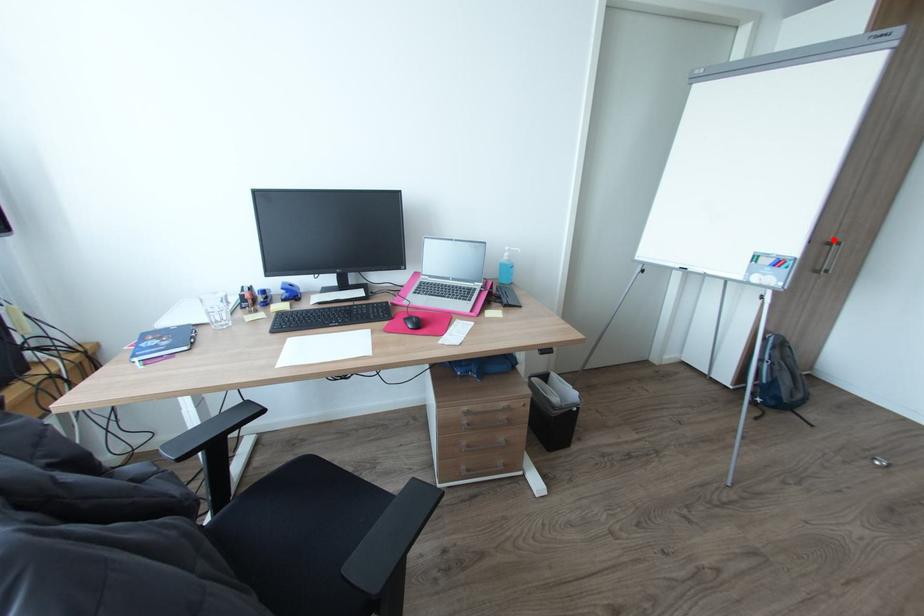
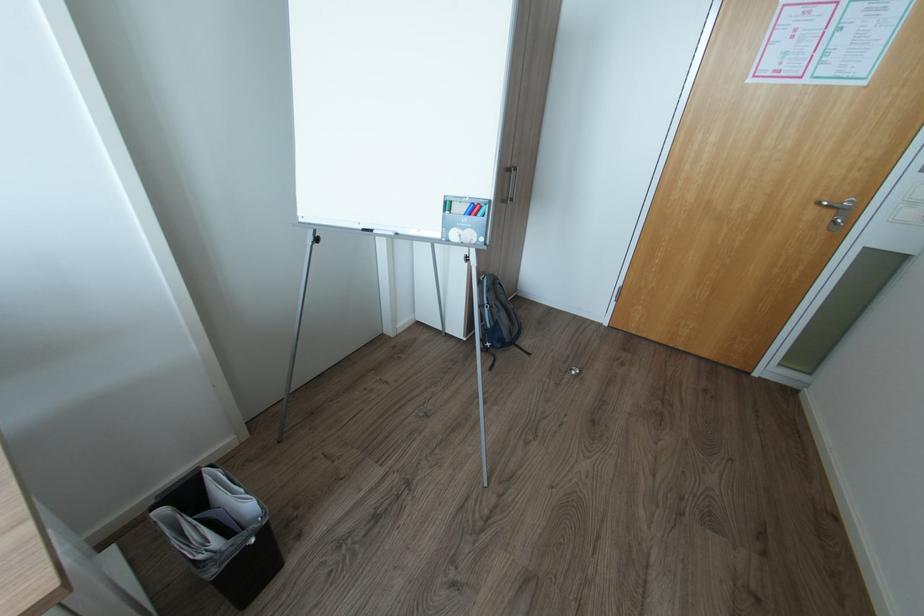
Question: A red point is marked in image1. In image2, is the corresponding 3D point closer to the camera or farther? Reply with the corresponding letter.

Choices:
 (A) The corresponding 3D point is closer.
 (B) The corresponding 3D point is farther.

Answer: (A)